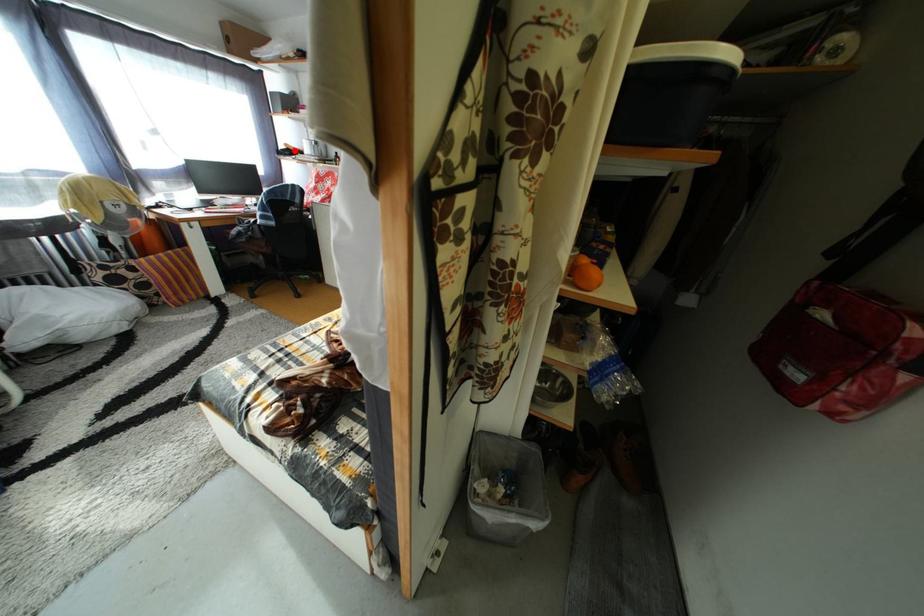
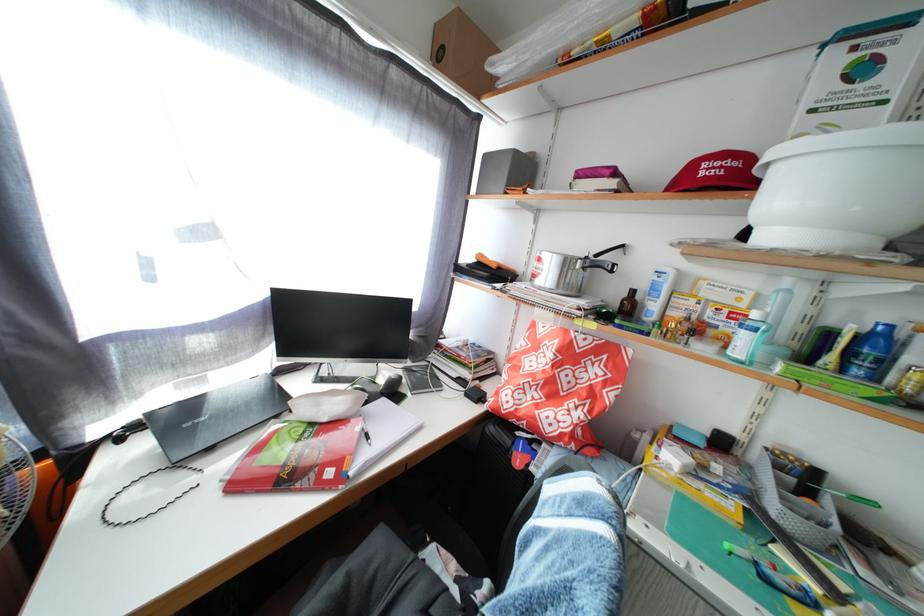
The point at the highlighted location is marked in the first image. Where is the corresponding point in the second image?

(489, 262)